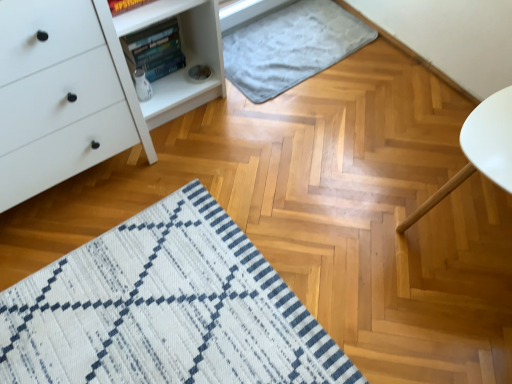
Locate an element on the screen. vacant space that is in between white matte table at right and gray soft rug at upper center is located at coordinates (373, 123).